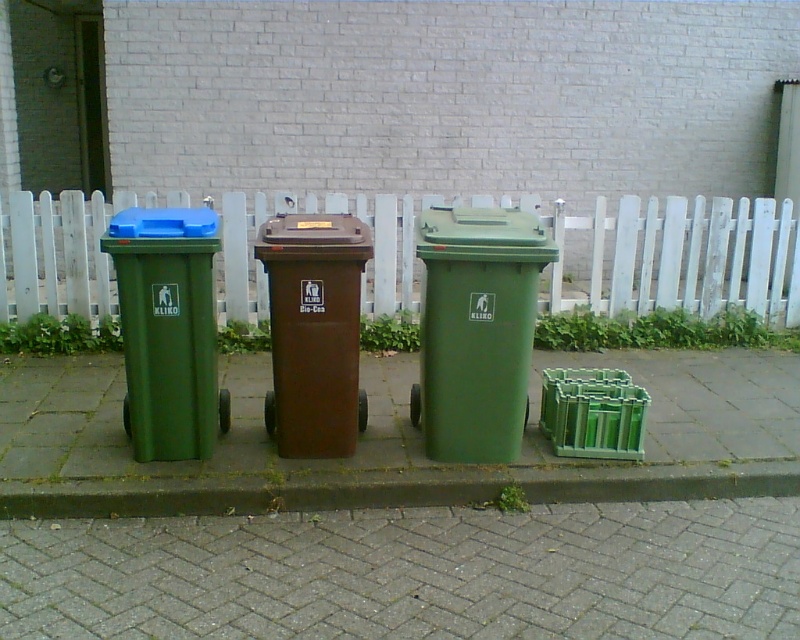
You are a delivery person who needs to park your 36 inch wide delivery cart between the green plastic recycling bin at center and the green concrete curb at lower center. Is there enough space for your cart to fit between them?

The distance between the green plastic recycling bin at center and the green concrete curb at lower center is 32.31 inches. Since the cart is 36 inches wide, it is wider than the available space. Therefore, the cart cannot fit between them.